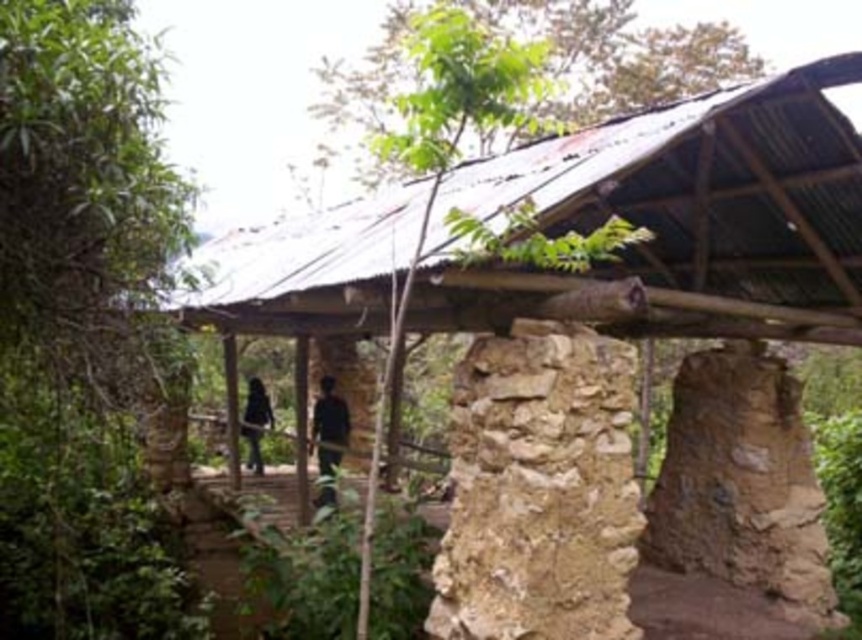
Question: Estimate the real-world distances between objects in this image. Which object is farther from the black matte clothing at center?

Choices:
 (A) green leafy tree at left
 (B) dark blue fabric at center

Answer: (A)

Question: Which object is the farthest from the green leafy tree at left?

Choices:
 (A) dark blue fabric at center
 (B) black matte clothing at center

Answer: (B)

Question: Can you confirm if dark blue fabric at center is positioned to the right of black matte clothing at center?

Choices:
 (A) yes
 (B) no

Answer: (A)

Question: Is green leafy tree at left to the right of dark blue fabric at center from the viewer's perspective?

Choices:
 (A) yes
 (B) no

Answer: (B)

Question: Which point is farther to the camera?

Choices:
 (A) black matte clothing at center
 (B) dark blue fabric at center

Answer: (A)

Question: Can you confirm if green leafy tree at left is positioned to the left of dark blue fabric at center?

Choices:
 (A) no
 (B) yes

Answer: (B)